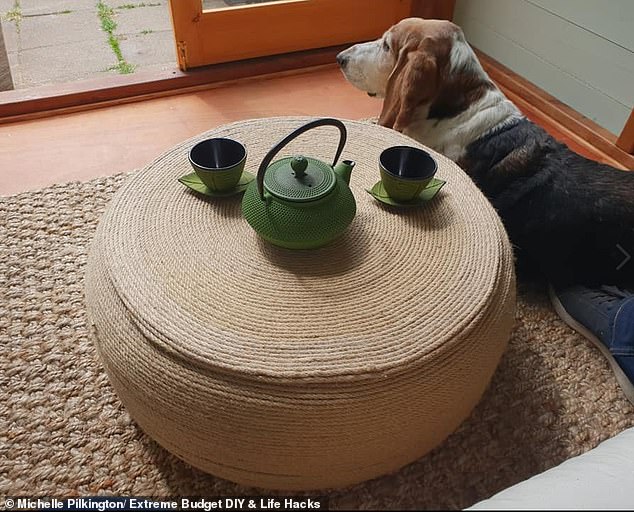
Where is `saucer`? The width and height of the screenshot is (634, 512). saucer is located at coordinates (416, 201), (198, 186).